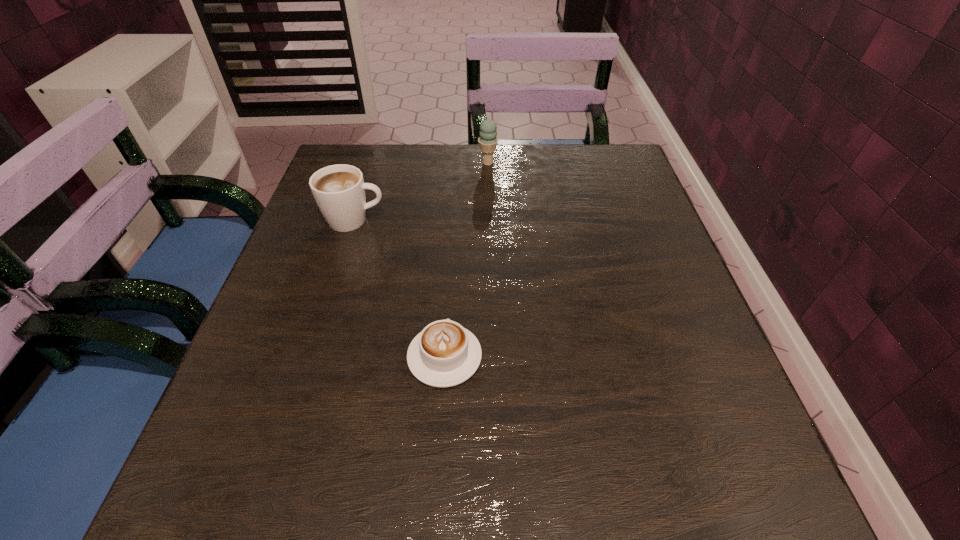
The height and width of the screenshot is (540, 960). Find the location of `ice cream`. ice cream is located at coordinates (487, 141).

Find the location of a particular element. the farther cappuccino is located at coordinates (339, 190).

This screenshot has height=540, width=960. In order to click on the second farthest object in this screenshot , I will do `click(339, 190)`.

This screenshot has width=960, height=540. I want to click on the right cappuccino, so click(444, 354).

The image size is (960, 540). Identify the location of the nearest object. (444, 354).

Identify the location of free spot located on the back of the ice cream. Image resolution: width=960 pixels, height=540 pixels. (488, 146).

Locate an element on the screen. vacant area situated with the handle on the side of the left cappuccino is located at coordinates pos(546,220).

Where is `vacant space situated 0.200m with the handle on the right side of the right cappuccino`? vacant space situated 0.200m with the handle on the right side of the right cappuccino is located at coordinates (451, 251).

Locate an element on the screen. The width and height of the screenshot is (960, 540). vacant region located with the handle on the right side of the right cappuccino is located at coordinates (453, 224).

Locate an element on the screen. The image size is (960, 540). blank area located with the handle on the right side of the right cappuccino is located at coordinates (448, 306).